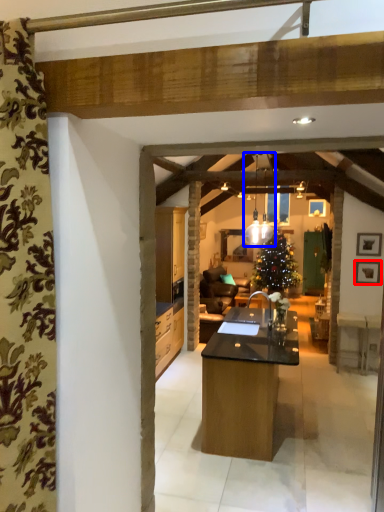
Question: Among these objects, which one is nearest to the camera, picture frame (highlighted by a red box) or light fixture (highlighted by a blue box)?

Choices:
 (A) picture frame
 (B) light fixture

Answer: (B)